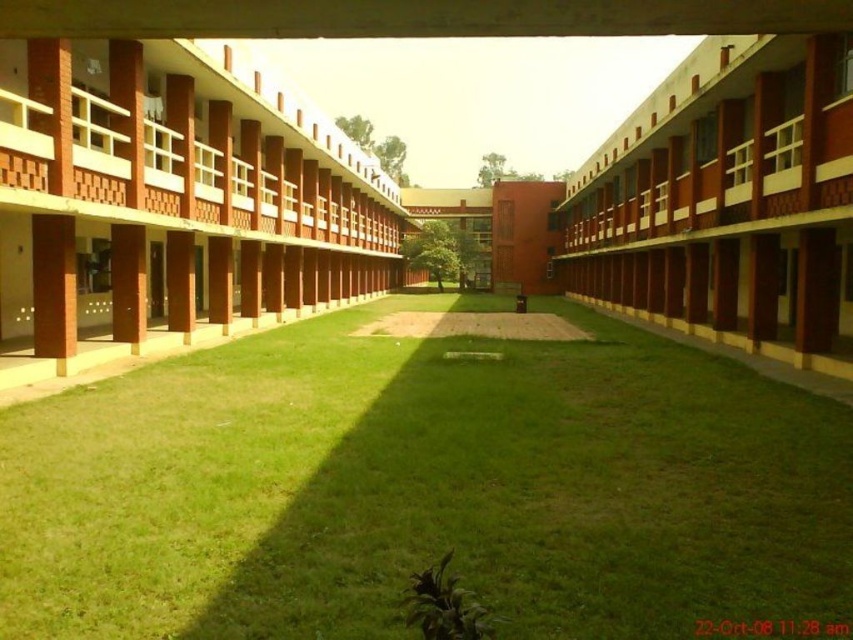
Is matte brick building at left thinner than matte brick building at center?

No, matte brick building at left is not thinner than matte brick building at center.

In the scene shown: Can you confirm if matte brick building at left is wider than matte brick building at center?

Yes, matte brick building at left is wider than matte brick building at center.

Is point (386, 212) behind point (697, 90)?

Yes, point (386, 212) is behind point (697, 90).

Find the location of a particular element. matte brick building at left is located at coordinates (171, 196).

Is green grass at center smaller than matte brick building at left?

Yes.

Which is in front, point (91, 612) or point (234, 83)?

Point (91, 612) is more forward.

Does point (357, 376) come farther from viewer compared to point (109, 209)?

That is True.

Locate an element on the screen. The width and height of the screenshot is (853, 640). green grass at center is located at coordinates (424, 488).

Based on the photo, who is higher up, green grass at center or matte brick building at center?

matte brick building at center

I want to click on green grass at center, so click(x=424, y=488).